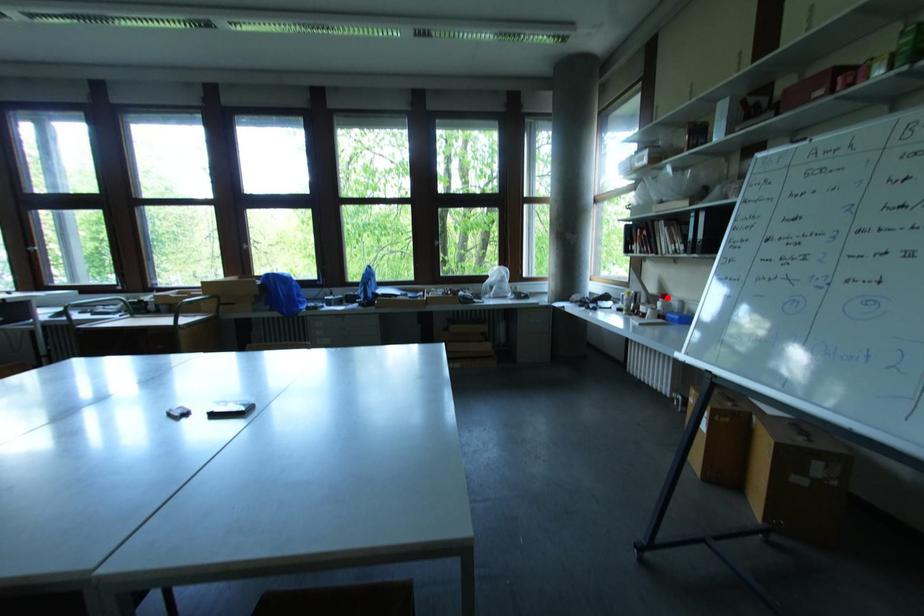
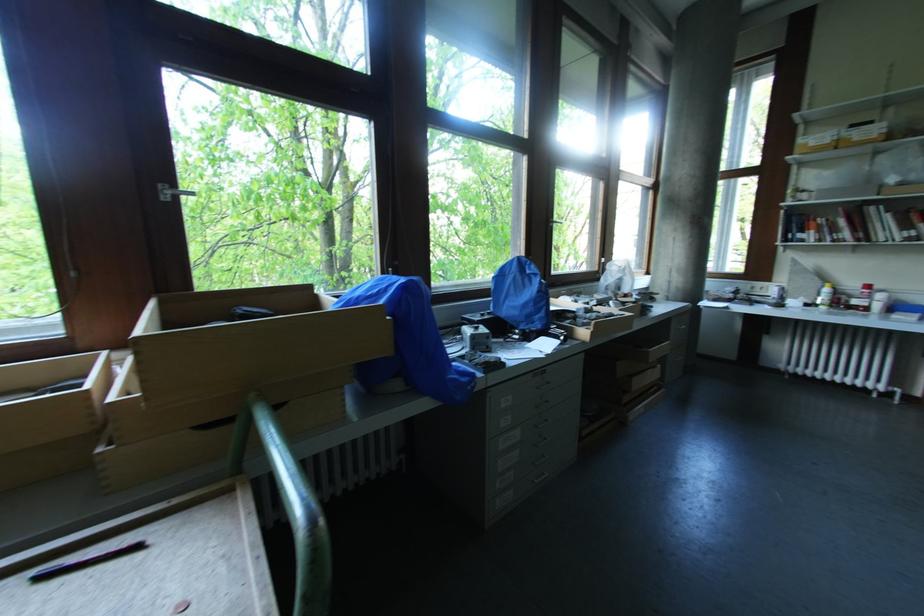
Question: I am providing you with two images of the same scene from different viewpoints. A red point is shown in image1. For the corresponding object point in image2, is it positioned nearer or farther from the camera?

Choices:
 (A) Nearer
 (B) Farther

Answer: (B)